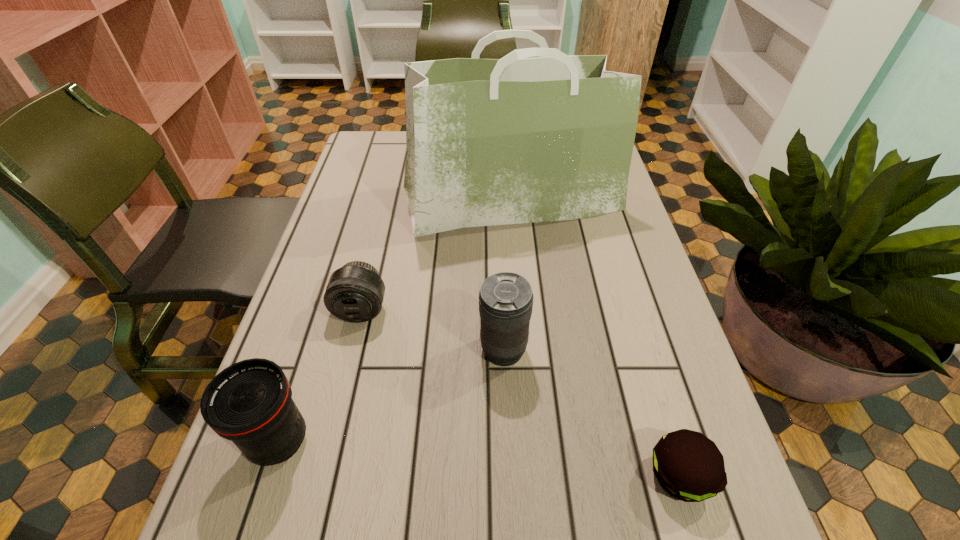
In the image, there is a desktop. Where is `free region at the right edge`? free region at the right edge is located at coordinates (601, 252).

This screenshot has width=960, height=540. In the image, there is a desktop. In order to click on vacant space at the far left corner in this screenshot , I will do `click(372, 138)`.

The height and width of the screenshot is (540, 960). In order to click on free space between the patty and the rightmost telephoto lens in this screenshot , I will do `click(591, 413)`.

Where is `free spot between the second farthest object and the shortest object`? free spot between the second farthest object and the shortest object is located at coordinates (520, 392).

Where is `free point between the grocery bag and the shortest object`? The image size is (960, 540). free point between the grocery bag and the shortest object is located at coordinates (595, 338).

This screenshot has height=540, width=960. I want to click on empty location between the farthest object and the fourth nearest object, so click(x=437, y=254).

The height and width of the screenshot is (540, 960). In order to click on free space between the nearest telephoto lens and the shortest object in this screenshot , I will do `click(479, 458)`.

Locate an element on the screen. Image resolution: width=960 pixels, height=540 pixels. free point between the farthest telephoto lens and the nearest telephoto lens is located at coordinates [x=321, y=375].

At what (x,y) coordinates should I click in order to perform the action: click on object that stands as the third closest to the nearest telephoto lens. Please return your answer as a coordinate pair (x, y). The width and height of the screenshot is (960, 540). Looking at the image, I should click on (503, 141).

Where is `object that is the nearest to the farthest object`? This screenshot has height=540, width=960. object that is the nearest to the farthest object is located at coordinates (355, 292).